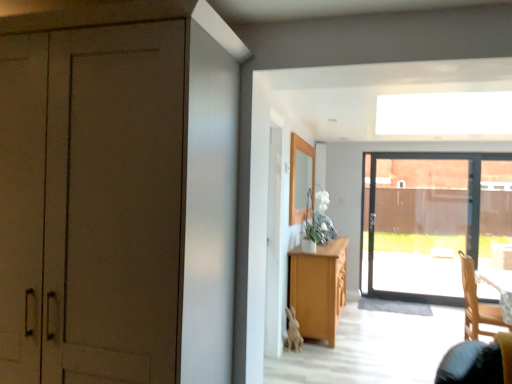
Question: In the image, is light wood cabinet at center on the left side or the right side of matte brown cabinet at left?

Choices:
 (A) right
 (B) left

Answer: (A)

Question: Is light wood cabinet at center bigger or smaller than matte brown cabinet at left?

Choices:
 (A) big
 (B) small

Answer: (B)

Question: Estimate the real-world distances between objects in this image. Which object is closer to the wooden chair at lower right?

Choices:
 (A) light wood cabinet at center
 (B) matte brown cabinet at left

Answer: (A)

Question: Considering the real-world distances, which object is closest to the wooden chair at lower right?

Choices:
 (A) matte brown cabinet at left
 (B) light wood cabinet at center

Answer: (B)